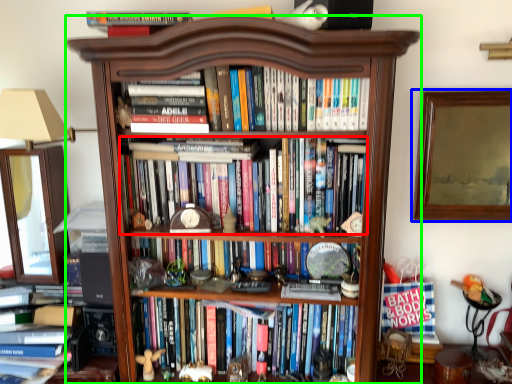
Question: Based on their relative distances, which object is farther from book (highlighted by a red box)? Choose from picture frame (highlighted by a blue box) and bookcase (highlighted by a green box).

Choices:
 (A) picture frame
 (B) bookcase

Answer: (A)